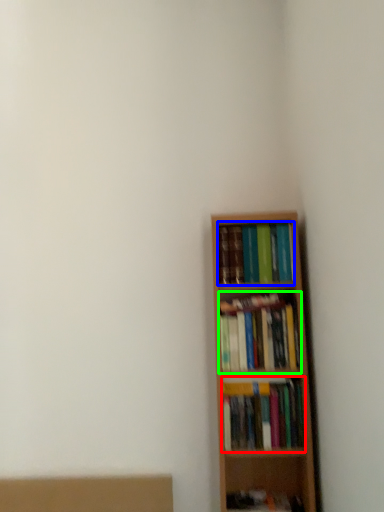
Question: Which object is the closest to the book (highlighted by a red box)? Choose among these: book (highlighted by a blue box) or book (highlighted by a green box).

Choices:
 (A) book
 (B) book

Answer: (B)